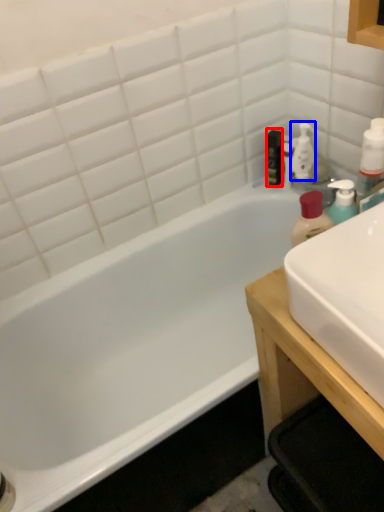
Question: Which object appears closest to the camera in this image, mouthwash (highlighted by a red box) or cleaning product (highlighted by a blue box)?

Choices:
 (A) mouthwash
 (B) cleaning product

Answer: (B)